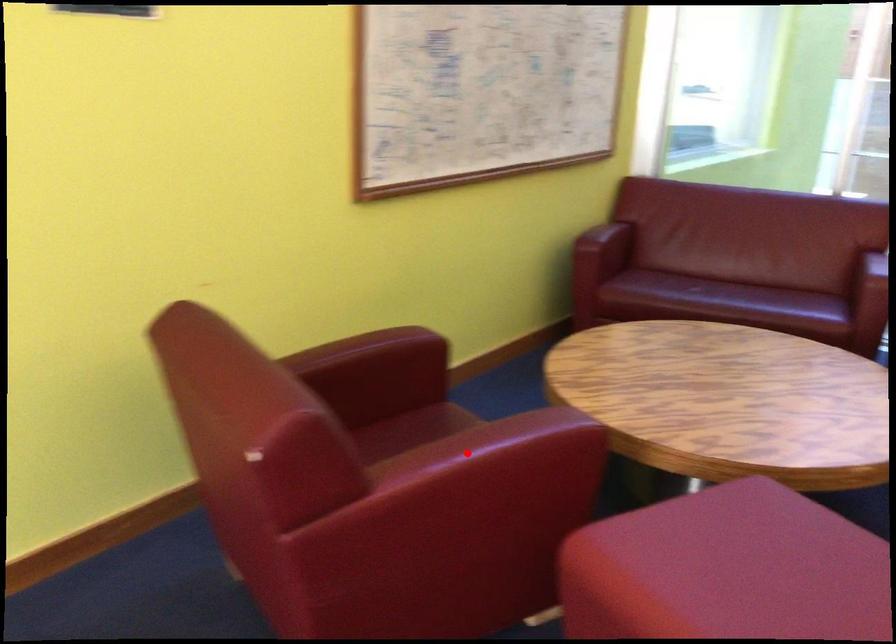
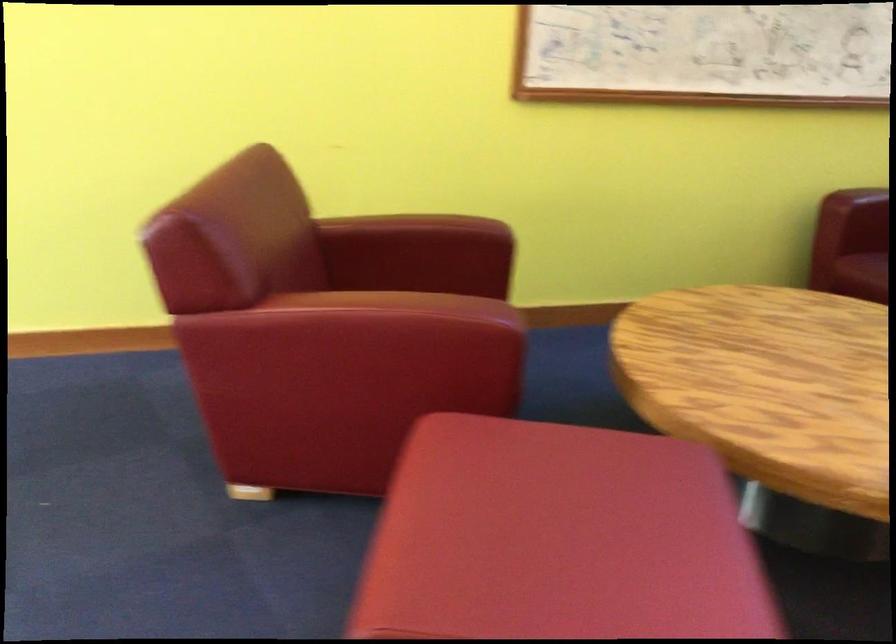
Question: I am providing you with two images of the same scene from different viewpoints. A red point is marked on the first image. Is the red point's position out of view in image 2?

Choices:
 (A) Yes
 (B) No

Answer: (B)